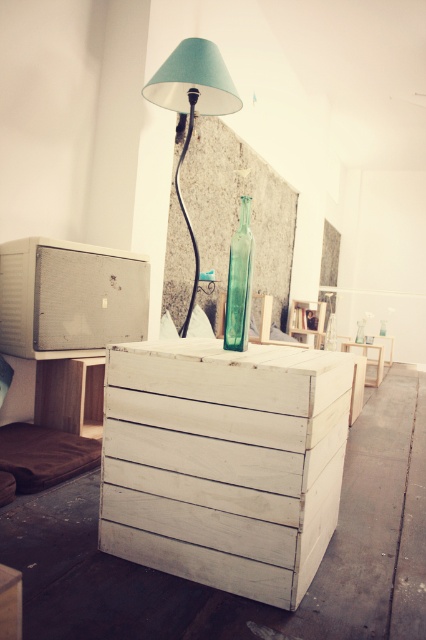
Question: Which of the following is the farthest from the observer?

Choices:
 (A) (238, 248)
 (B) (146, 456)

Answer: (A)

Question: Which point is farther to the camera?

Choices:
 (A) matte teal lampshade at upper center
 (B) white wood crate at center
 (C) transparent glass bottle at center
 (D) white wood table at center

Answer: (D)

Question: Is matte teal lampshade at upper center to the right of transparent glass bottle at center from the viewer's perspective?

Choices:
 (A) yes
 (B) no

Answer: (B)

Question: Is white wood crate at center positioned behind matte teal lampshade at upper center?

Choices:
 (A) no
 (B) yes

Answer: (A)

Question: Considering the real-world distances, which object is closest to the transparent glass bottle at center?

Choices:
 (A) white wood table at center
 (B) matte teal lampshade at upper center

Answer: (B)

Question: In this image, where is transparent glass bottle at center located relative to white wood table at center?

Choices:
 (A) right
 (B) left

Answer: (B)